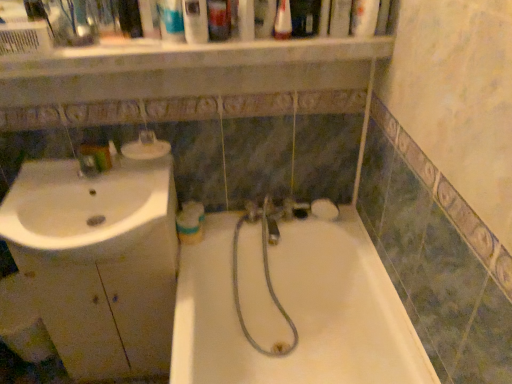
Locate an element on the screen. free point to the right of white glossy mouthwash at center, which is the 4th mouthwash in top-to-bottom order is located at coordinates (228, 229).